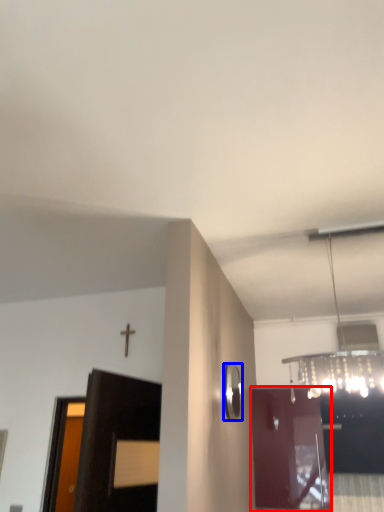
Question: Among these objects, which one is nearest to the camera, door (highlighted by a red box) or mirror (highlighted by a blue box)?

Choices:
 (A) door
 (B) mirror

Answer: (B)